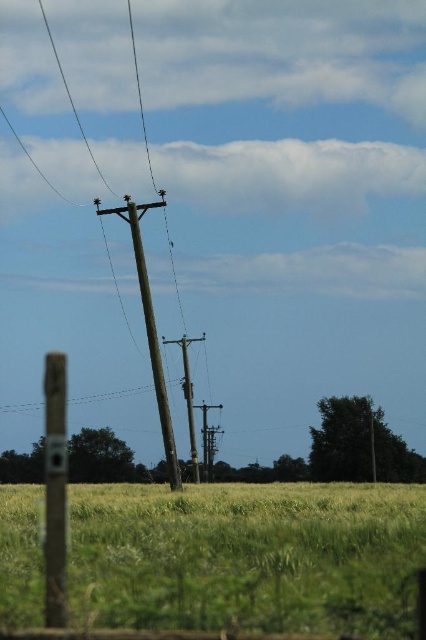
From the picture: You are standing in a rural field with wooden posts and utility poles. You see two points marked in the image, one at coordinates point (51, 509) and the other at point (170, 456). Which point is nearer to you?

Point (51, 509) is closer to the viewer than point (170, 456).